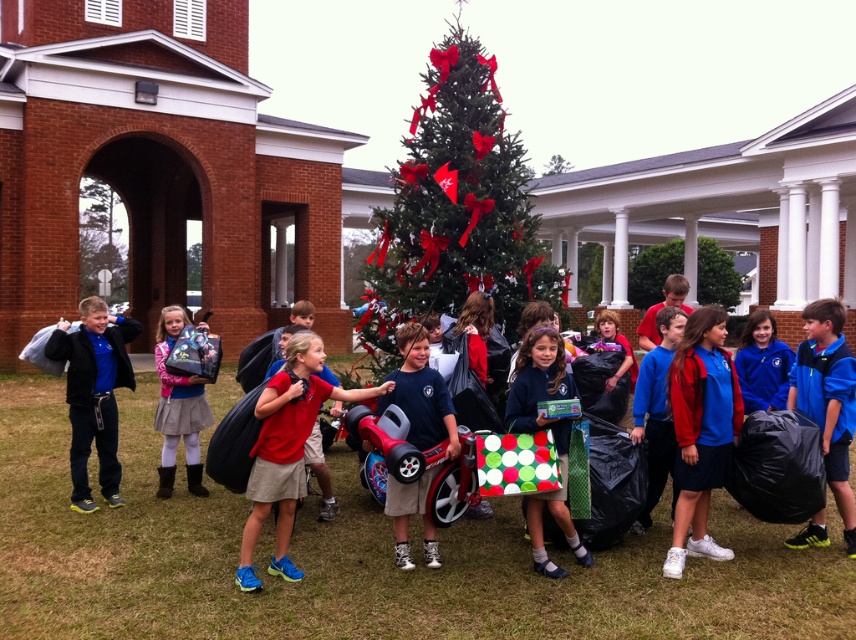
Question: Is the position of blue fabric shirt at center more distant than that of matte black backpack at center?

Choices:
 (A) yes
 (B) no

Answer: (B)

Question: Which point is farther to the camera?

Choices:
 (A) (562, 356)
 (B) (717, 556)

Answer: (B)

Question: Which object appears farthest from the camera in this image?

Choices:
 (A) blue fleece jacket at left
 (B) matte black backpack at center
 (C) polka dot paper bag at center

Answer: (B)

Question: Which object appears farthest from the camera in this image?

Choices:
 (A) red matte shirt at center
 (B) blue fleece jacket at left
 (C) green artificial christmas tree at center

Answer: (B)

Question: Is blue fabric jacket at center to the left of red matte shirt at center from the viewer's perspective?

Choices:
 (A) no
 (B) yes

Answer: (A)

Question: Is green artificial christmas tree at center wider than blue fleece jacket at left?

Choices:
 (A) yes
 (B) no

Answer: (A)